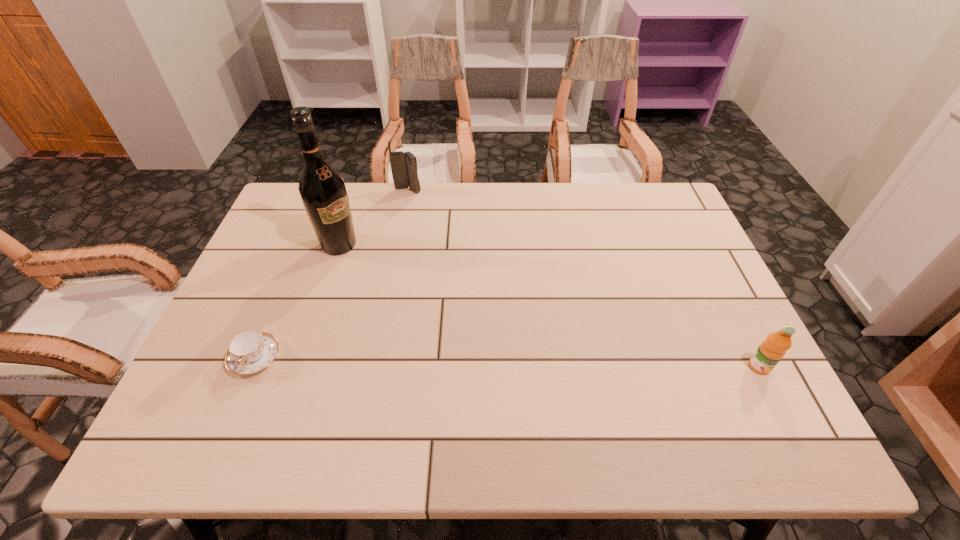
I want to click on vacant spot on the desktop that is between the teacup and the rightmost object and is positioned on the label of the second farthest object, so click(x=514, y=362).

The height and width of the screenshot is (540, 960). Find the location of `free space on the desktop that is between the shortest object and the orange juice and is positioned on the keyboard of the second tallest object`. free space on the desktop that is between the shortest object and the orange juice and is positioned on the keyboard of the second tallest object is located at coordinates [x=435, y=361].